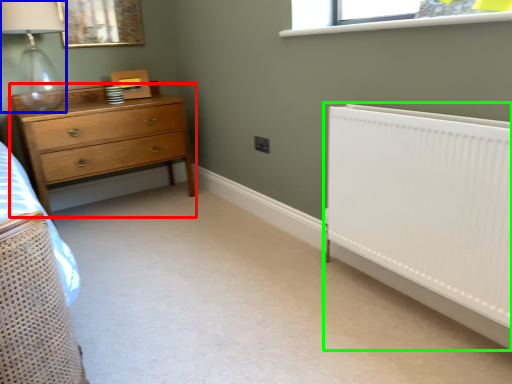
Question: Estimate the real-world distances between objects in this image. Which object is closer to chest of drawers (highlighted by a red box), lamp (highlighted by a blue box) or radiator (highlighted by a green box)?

Choices:
 (A) lamp
 (B) radiator

Answer: (A)